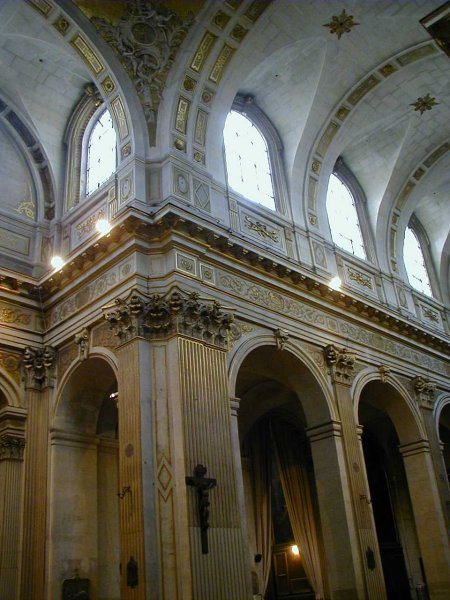
The image size is (450, 600). Identify the location of ceiling. (362, 52).